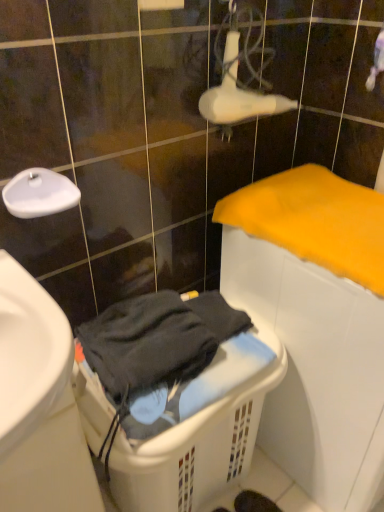
Question: Can we say yellow soft cloth at right lies outside white glossy faucet at upper left?

Choices:
 (A) yes
 (B) no

Answer: (A)

Question: Is yellow soft cloth at right looking in the opposite direction of white glossy faucet at upper left?

Choices:
 (A) no
 (B) yes

Answer: (A)

Question: Can you confirm if yellow soft cloth at right is thinner than white glossy faucet at upper left?

Choices:
 (A) yes
 (B) no

Answer: (B)

Question: Is yellow soft cloth at right further to camera compared to white glossy faucet at upper left?

Choices:
 (A) no
 (B) yes

Answer: (A)

Question: Is yellow soft cloth at right shorter than white glossy faucet at upper left?

Choices:
 (A) no
 (B) yes

Answer: (A)

Question: Is yellow soft cloth at right closer to the viewer compared to white glossy faucet at upper left?

Choices:
 (A) no
 (B) yes

Answer: (B)

Question: From a real-world perspective, is white plastic laundry basket at lower center below yellow soft cloth at right?

Choices:
 (A) yes
 (B) no

Answer: (A)

Question: Can you confirm if white plastic laundry basket at lower center is wider than yellow soft cloth at right?

Choices:
 (A) yes
 (B) no

Answer: (B)

Question: Can you confirm if white plastic laundry basket at lower center is thinner than yellow soft cloth at right?

Choices:
 (A) yes
 (B) no

Answer: (A)

Question: Can you confirm if white plastic laundry basket at lower center is bigger than yellow soft cloth at right?

Choices:
 (A) no
 (B) yes

Answer: (B)

Question: Is white plastic laundry basket at lower center turned away from yellow soft cloth at right?

Choices:
 (A) yes
 (B) no

Answer: (B)

Question: From a real-world perspective, is white plastic laundry basket at lower center on yellow soft cloth at right?

Choices:
 (A) no
 (B) yes

Answer: (A)

Question: Is white plastic laundry basket at lower center to the left of white glossy faucet at upper left from the viewer's perspective?

Choices:
 (A) no
 (B) yes

Answer: (A)